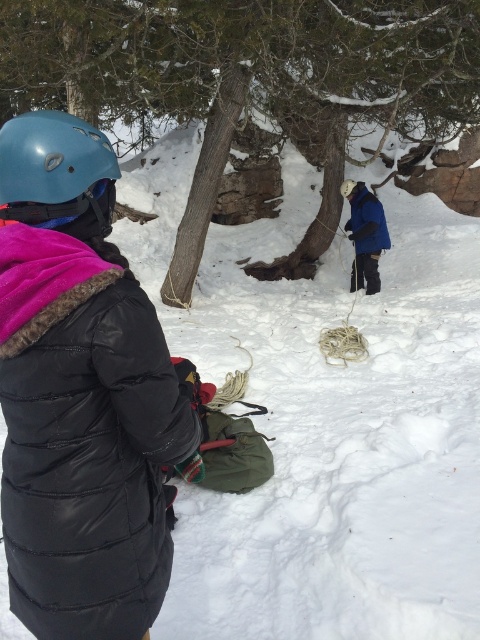
Is blue fleece jacket at center further to the viewer compared to blue matte helmet at upper left?

Yes.

Does blue fleece jacket at center come in front of blue matte helmet at upper left?

No, it is not.

Locate an element on the screen. The width and height of the screenshot is (480, 640). blue fleece jacket at center is located at coordinates (364, 234).

Who is higher up, black puffy jacket at left or matte blue helmet at upper left?

matte blue helmet at upper left is above.

Is black puffy jacket at left smaller than matte blue helmet at upper left?

No.

Which is in front, point (25, 278) or point (36, 202)?

Point (25, 278) is in front.

Identify the location of black puffy jacket at left. This screenshot has height=640, width=480. (80, 394).

Is black puffy jacket at left bigger than blue fleece jacket at center?

No.

From the picture: Measure the distance between black puffy jacket at left and camera.

5.43 feet

At what (x,y) coordinates should I click in order to perform the action: click on black puffy jacket at left. Please return your answer as a coordinate pair (x, y). Looking at the image, I should click on (80, 394).